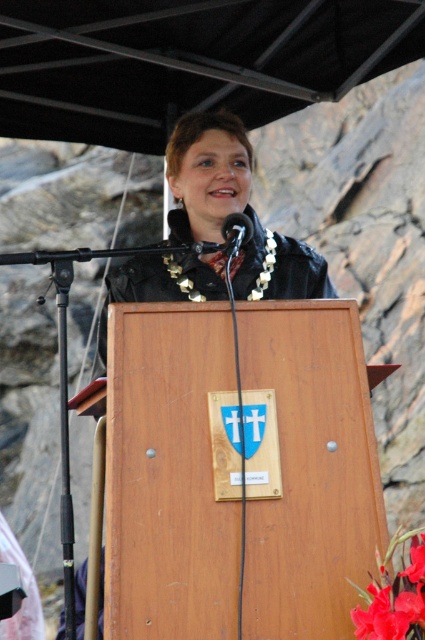
Can you confirm if black matte canopy at upper center is positioned above black plastic microphone at center?

Yes.

Between point (34, 26) and point (226, 220), which one is positioned behind?

The point (34, 26) is more distant.

What do you see at coordinates (187, 61) in the screenshot?
I see `black matte canopy at upper center` at bounding box center [187, 61].

Find the location of `black matte canopy at upper center`. black matte canopy at upper center is located at coordinates (187, 61).

Which is more to the left, glossy floral at center or black plastic microphone at center?

Positioned to the left is black plastic microphone at center.

Locate an element on the screen. The width and height of the screenshot is (425, 640). glossy floral at center is located at coordinates click(x=394, y=595).

Identify the location of glossy floral at center. Image resolution: width=425 pixels, height=640 pixels. (394, 595).

Who is taller, black matte canopy at upper center or glossy floral at center?

black matte canopy at upper center

Is black matte canopy at upper center above glossy floral at center?

Correct, black matte canopy at upper center is located above glossy floral at center.

Find the location of a particular element. black matte canopy at upper center is located at coordinates (187, 61).

This screenshot has width=425, height=640. I want to click on black matte canopy at upper center, so click(x=187, y=61).